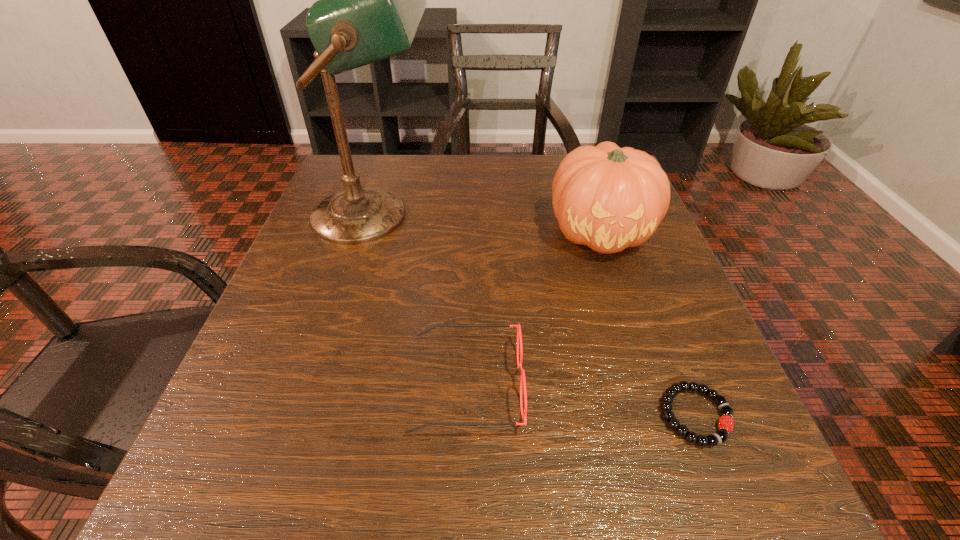
Locate an element on the screen. The width and height of the screenshot is (960, 540). object that is at the left edge is located at coordinates (370, 0).

The image size is (960, 540). I want to click on pumpkin positioned at the right edge, so click(608, 198).

Find the location of a particular element. The width and height of the screenshot is (960, 540). bracelet located in the right edge section of the desktop is located at coordinates (725, 424).

Where is `object situated at the far left corner`? object situated at the far left corner is located at coordinates (370, 0).

At what (x,y) coordinates should I click in order to perform the action: click on object present at the far right corner. Please return your answer as a coordinate pair (x, y). The image size is (960, 540). Looking at the image, I should click on (608, 198).

At what (x,y) coordinates should I click in order to perform the action: click on vacant space at the far edge of the desktop. Please return your answer as a coordinate pair (x, y). Image resolution: width=960 pixels, height=540 pixels. Looking at the image, I should click on (483, 163).

In the image, there is a desktop. Where is `vacant area at the near edge`? The width and height of the screenshot is (960, 540). vacant area at the near edge is located at coordinates (597, 453).

Locate an element on the screen. This screenshot has width=960, height=540. free space at the left edge of the desktop is located at coordinates (315, 253).

Locate an element on the screen. This screenshot has height=540, width=960. vacant area at the right edge is located at coordinates (674, 305).

The width and height of the screenshot is (960, 540). What are the coordinates of `free location at the near left corner` in the screenshot? It's located at (269, 479).